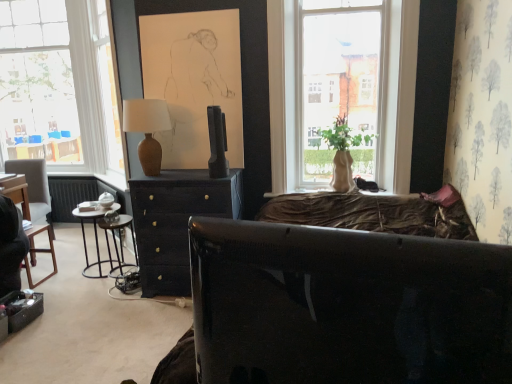
Question: Is metallic black nightstand at left shorter than transparent glass window at left?

Choices:
 (A) yes
 (B) no

Answer: (A)

Question: From a real-world perspective, is metallic black nightstand at left on top of transparent glass window at left?

Choices:
 (A) no
 (B) yes

Answer: (A)

Question: Does metallic black nightstand at left have a larger size compared to transparent glass window at left?

Choices:
 (A) yes
 (B) no

Answer: (B)

Question: Is metallic black nightstand at left positioned beyond the bounds of transparent glass window at left?

Choices:
 (A) yes
 (B) no

Answer: (A)

Question: Is metallic black nightstand at left positioned before transparent glass window at left?

Choices:
 (A) no
 (B) yes

Answer: (B)

Question: From the image's perspective, is metallic black nightstand at left above transparent glass window at left?

Choices:
 (A) no
 (B) yes

Answer: (A)

Question: From the image's perspective, would you say matte dark wood dresser at center is positioned over glossy black studio couch at center?

Choices:
 (A) yes
 (B) no

Answer: (A)

Question: Is matte dark wood dresser at center positioned in front of glossy black studio couch at center?

Choices:
 (A) yes
 (B) no

Answer: (B)

Question: Is matte dark wood dresser at center located outside glossy black studio couch at center?

Choices:
 (A) no
 (B) yes

Answer: (B)

Question: Would you consider matte dark wood dresser at center to be distant from glossy black studio couch at center?

Choices:
 (A) yes
 (B) no

Answer: (A)

Question: Could glossy black studio couch at center be considered to be inside matte dark wood dresser at center?

Choices:
 (A) yes
 (B) no

Answer: (B)

Question: Is matte dark wood dresser at center positioned behind glossy black studio couch at center?

Choices:
 (A) no
 (B) yes

Answer: (B)

Question: Is dark gray fabric chair at left closer to camera compared to matte brown vase at center?

Choices:
 (A) yes
 (B) no

Answer: (B)